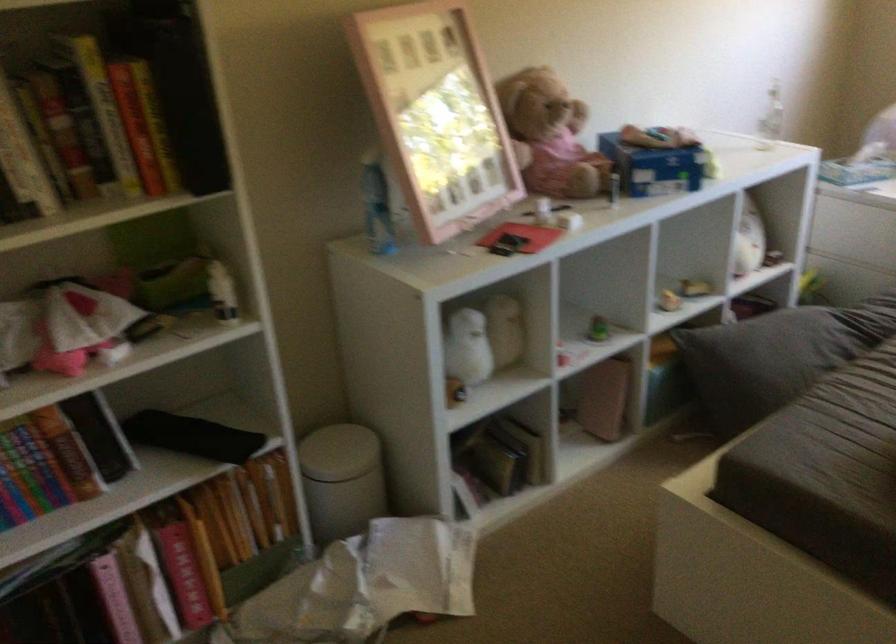
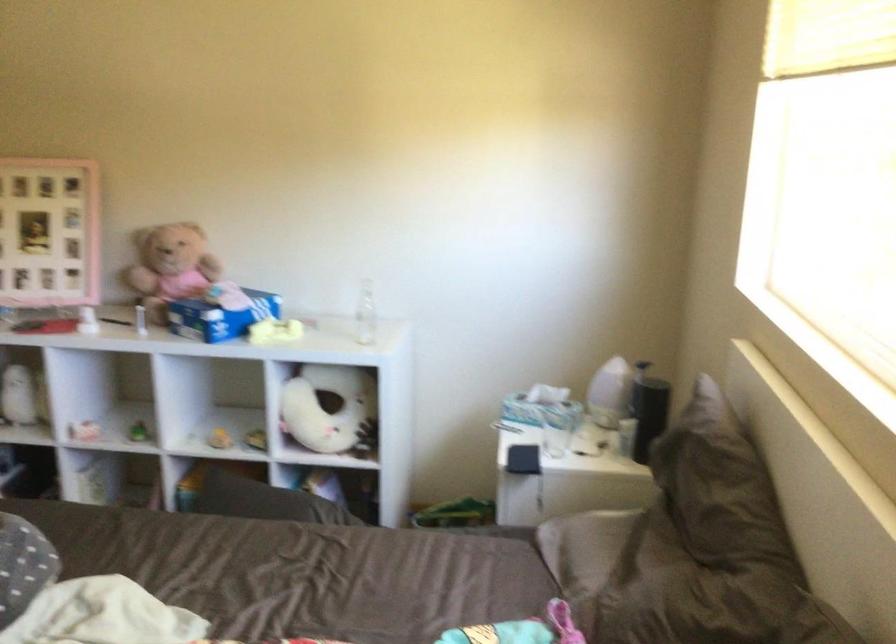
Question: I am providing you with two images of the same scene from different viewpoints. Which of the following objects are not visible in image2?

Choices:
 (A) black rectangular object
 (B) clear water bottle
 (C) grey storage bin
 (D) cardboard tissue box

Answer: (B)